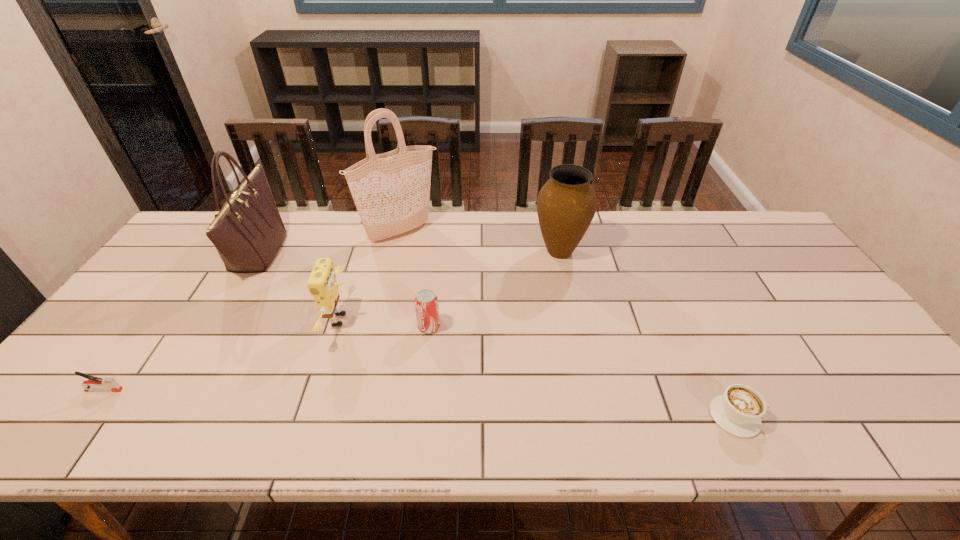
Locate an element on the screen. The width and height of the screenshot is (960, 540). free point between the sponge and the shopping bag is located at coordinates (371, 276).

At what (x,y) coordinates should I click in order to perform the action: click on free space between the urn and the shopping bag. Please return your answer as a coordinate pair (x, y). Looking at the image, I should click on (480, 241).

Where is `free point between the sponge and the sixth shortest object`? The image size is (960, 540). free point between the sponge and the sixth shortest object is located at coordinates (299, 286).

This screenshot has width=960, height=540. Find the location of `vacant area that lies between the sixth object from left to right and the second tallest object`. vacant area that lies between the sixth object from left to right and the second tallest object is located at coordinates (409, 252).

I want to click on empty space between the nearest object and the second object from right to left, so click(x=648, y=334).

Locate an element on the screen. Image resolution: width=960 pixels, height=540 pixels. vacant space that's between the second tallest object and the fifth tallest object is located at coordinates (344, 289).

Image resolution: width=960 pixels, height=540 pixels. I want to click on free space between the nearest object and the urn, so click(648, 334).

Image resolution: width=960 pixels, height=540 pixels. I want to click on object that can be found as the second closest to the third tallest object, so click(426, 301).

Choose which object is the third nearest neighbor to the stapler. Please provide its 2D coordinates. Your answer should be formatted as a tuple, i.e. [(x, y)], where the tuple contains the x and y coordinates of a point satisfying the conditions above.

[(391, 191)]